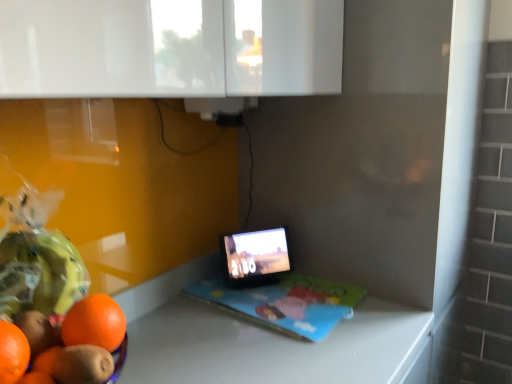
At what (x,y) coordinates should I click in order to perform the action: click on empty space that is ontop of matte black laptop at center. Please return your answer as a coordinate pair (x, y). The height and width of the screenshot is (384, 512). Looking at the image, I should click on (273, 290).